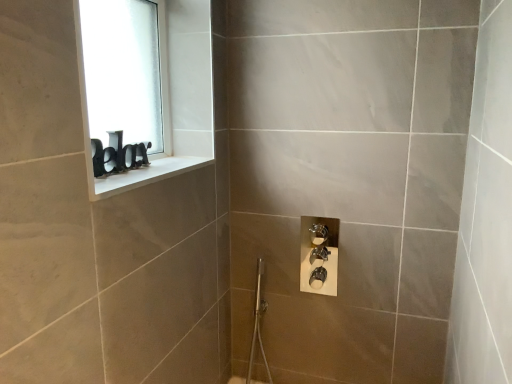
Question: From the image's perspective, is white frosted glass at upper left located above or below white glossy window sill at upper left?

Choices:
 (A) above
 (B) below

Answer: (A)

Question: In terms of height, does white frosted glass at upper left look taller or shorter compared to white glossy window sill at upper left?

Choices:
 (A) short
 (B) tall

Answer: (B)

Question: Would you say white frosted glass at upper left is to the left or to the right of white glossy window sill at upper left in the picture?

Choices:
 (A) left
 (B) right

Answer: (A)

Question: From a real-world perspective, is white glossy window sill at upper left physically located above or below white frosted glass at upper left?

Choices:
 (A) below
 (B) above

Answer: (A)

Question: Is white glossy window sill at upper left bigger or smaller than white frosted glass at upper left?

Choices:
 (A) big
 (B) small

Answer: (B)

Question: Which is correct: white glossy window sill at upper left is inside white frosted glass at upper left, or outside of it?

Choices:
 (A) outside
 (B) inside

Answer: (A)

Question: From the image's perspective, is white glossy window sill at upper left above or below white frosted glass at upper left?

Choices:
 (A) below
 (B) above

Answer: (A)